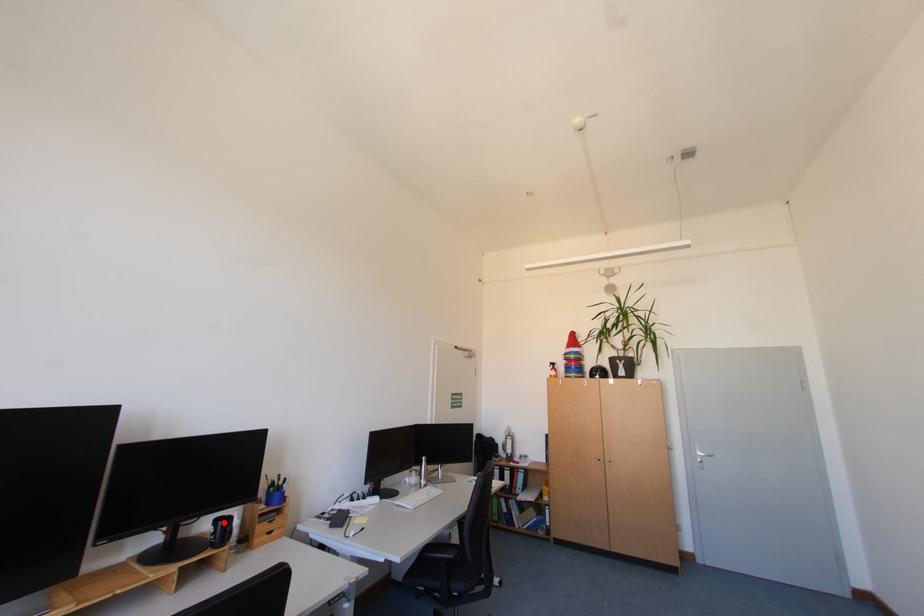
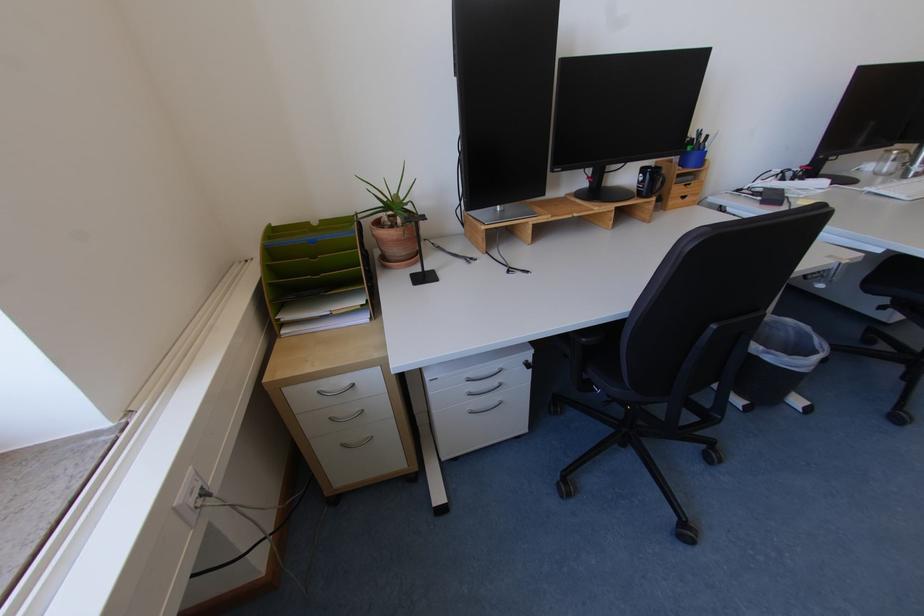
Locate, in the second image, the point that corresponds to the highlighted location in the first image.

(650, 171)